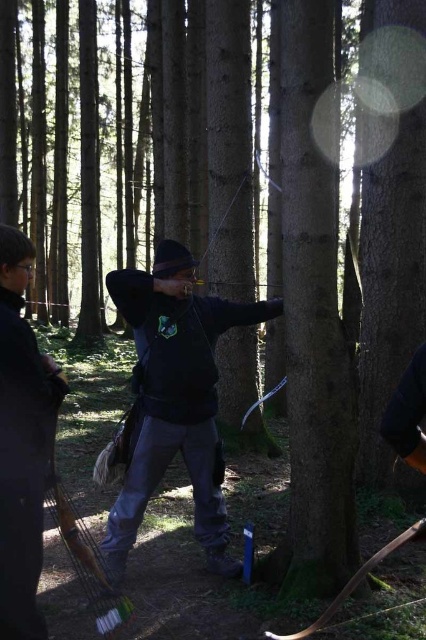
You are standing in the forest and want to shoot an arrow to hit a target located at point (123, 536). The target is 3.81 meters away from you. If your arrow can travel 4 meters, will it reach the target?

The distance of point (123, 536) from viewer is 3.81 meters, so yes, the arrow can reach the target since it can travel 4 meters which is farther than the distance to the target.

You are an archer in the forest and see two jackets at center. Which jacket is closer to you, the dark blue fabric jacket at center or the black matte jacket at center?

The dark blue fabric jacket at center is closer to you because it is further to the viewer than the black matte jacket at center.